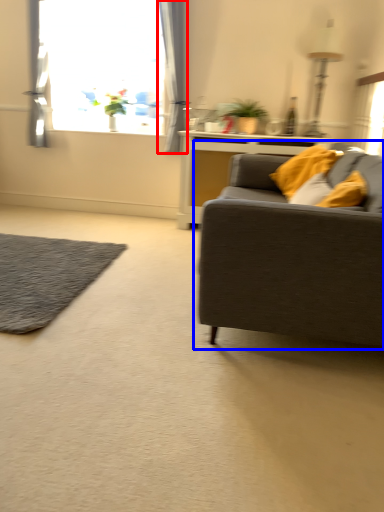
Question: Among these objects, which one is nearest to the camera, curtain (highlighted by a red box) or studio couch (highlighted by a blue box)?

Choices:
 (A) curtain
 (B) studio couch

Answer: (B)